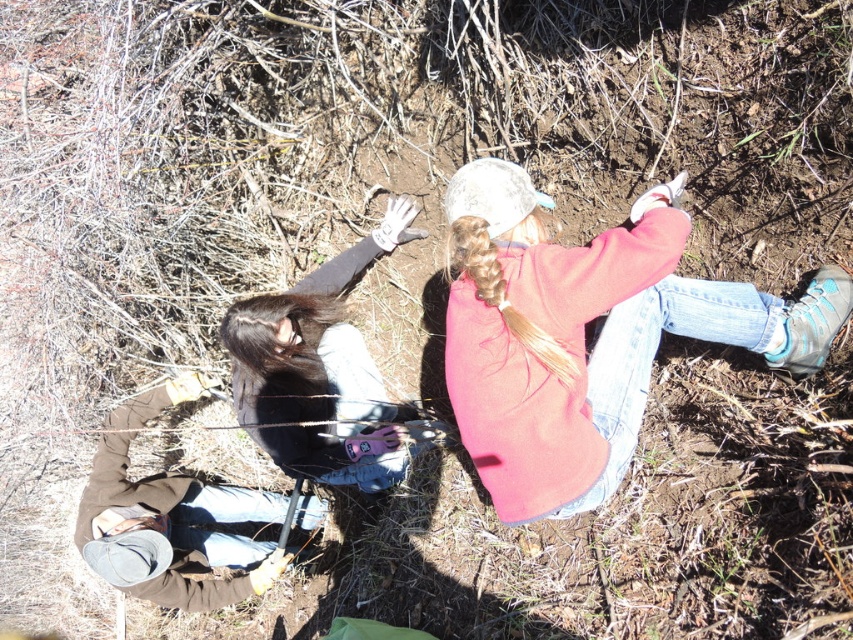
You are a fashion designer observing two jackets in an outdoor scene. The jackets are the dark brown leather jacket at lower left and the brown suede jacket at lower left. Which jacket is bigger in size?

The dark brown leather jacket at lower left is larger in size compared to the brown suede jacket at lower left according to the description.

You are a fashion designer observing two jackets in a photo. You see the dark brown leather jacket at lower left and the brown suede jacket at lower left. Which one is more to the right?

The dark brown leather jacket at lower left is positioned on the right side of brown suede jacket at lower left, so it is more to the right.